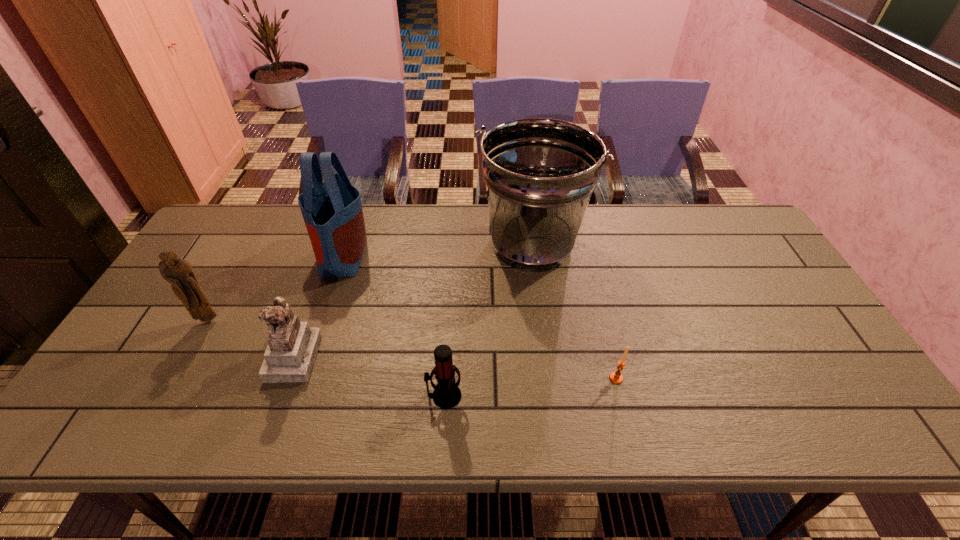
Locate an element on the screen. This screenshot has height=540, width=960. empty space that is in between the farther figurine and the microphone is located at coordinates (326, 358).

This screenshot has width=960, height=540. Identify the location of free space between the right figurine and the handbag. (319, 305).

Choose which object is the third nearest neighbor to the microphone. Please provide its 2D coordinates. Your answer should be formatted as a tuple, i.e. [(x, y)], where the tuple contains the x and y coordinates of a point satisfying the conditions above.

[(615, 377)]

Image resolution: width=960 pixels, height=540 pixels. Find the location of `the closest object to the handbag`. the closest object to the handbag is located at coordinates (292, 346).

You are a GUI agent. You are given a task and a screenshot of the screen. Output one action in this format:
    pyautogui.click(x=<x>, y=<y>)
    Task: Click on the free space that satisfies the following two spatial constraints: 1. on the front-facing side of the shortest object; 2. on the left side of the third shortest object
    This screenshot has width=960, height=540.
    Given the screenshot: What is the action you would take?
    pyautogui.click(x=286, y=378)

Locate an element on the screen. free space in the image that satisfies the following two spatial constraints: 1. on the front-facing side of the third object from right to left; 2. on the left side of the leftmost object is located at coordinates (166, 396).

Locate an element on the screen. This screenshot has height=540, width=960. vacant space that satisfies the following two spatial constraints: 1. on the front-facing side of the fourth tallest object; 2. on the back side of the fourth object from left to right is located at coordinates (279, 396).

I want to click on vacant space that satisfies the following two spatial constraints: 1. on the front side of the candle_holder; 2. on the right side of the handbag, so click(x=303, y=378).

Locate an element on the screen. The image size is (960, 540). free space that satisfies the following two spatial constraints: 1. on the front side of the shortest object; 2. on the right side of the bucket is located at coordinates (546, 378).

Locate an element on the screen. This screenshot has width=960, height=540. free space that satisfies the following two spatial constraints: 1. on the front-facing side of the fourth object from left to right; 2. on the left side of the left figurine is located at coordinates (166, 396).